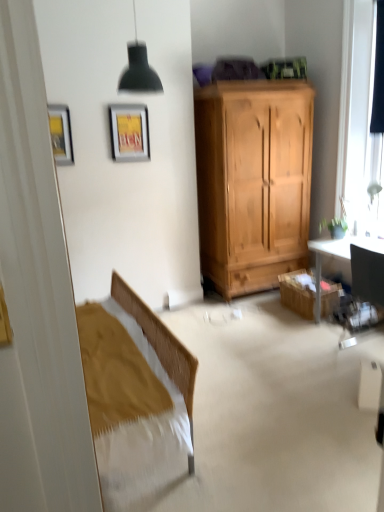
You are a GUI agent. You are given a task and a screenshot of the screen. Output one action in this format:
    pyautogui.click(x=<x>, y=<y>)
    Task: Click on the black fabric curtain at right
    The height and width of the screenshot is (512, 384).
    Given the screenshot: What is the action you would take?
    pyautogui.click(x=378, y=75)

Identify the location of transparent glass window at upper right. [x=357, y=109].

Measure the distance between transparent glass window at upper right and camera.

3.41 meters.

Identify the location of metallic silver picture frame at upper center, which appears as the second picture frame when viewed from the left. (129, 132).

This screenshot has height=512, width=384. Describe the element at coordinates (298, 292) in the screenshot. I see `wooden cabinet at lower right` at that location.

Identify the location of black fabric curtain at right. Image resolution: width=384 pixels, height=512 pixels. (378, 75).

Could you tell me if matte black lampshade at upper center is turned towards black fabric curtain at right?

No, matte black lampshade at upper center is not facing towards black fabric curtain at right.

From the image's perspective, which is below, matte black lampshade at upper center or black fabric curtain at right?

matte black lampshade at upper center, from the image's perspective.

Based on the photo, does matte black lampshade at upper center come behind black fabric curtain at right?

No, matte black lampshade at upper center is in front of black fabric curtain at right.

Does matte black lampshade at upper center have a lesser height compared to black fabric curtain at right?

Yes.

Who is shorter, wooden cabinet at lower right or metallic silver picture frame at upper center, arranged as the first picture frame when viewed from the back?

With less height is wooden cabinet at lower right.

Considering the sizes of wooden cabinet at lower right and metallic silver picture frame at upper center, which is the second picture frame from front to back, in the image, is wooden cabinet at lower right wider or thinner than metallic silver picture frame at upper center, which is the second picture frame from front to back,?

Considering their sizes, wooden cabinet at lower right looks broader than metallic silver picture frame at upper center, which is the second picture frame from front to back.

Which point is more forward, (310,308) or (124,142)?

Positioned in front is point (124,142).

Which is correct: wooden cabinet at lower right is inside metallic silver picture frame at upper center, arranged as the first picture frame when viewed from the back, or outside of it?

wooden cabinet at lower right is located beyond the bounds of metallic silver picture frame at upper center, arranged as the first picture frame when viewed from the back.

Which object is wider, metallic silver picture frame at upper center, which is the second picture frame from front to back, or black fabric curtain at right?

metallic silver picture frame at upper center, which is the second picture frame from front to back, is wider.

Considering the relative sizes of metallic silver picture frame at upper center, placed as the first picture frame when sorted from right to left, and black fabric curtain at right in the image provided, is metallic silver picture frame at upper center, placed as the first picture frame when sorted from right to left, shorter than black fabric curtain at right?

Yes.

From a real-world perspective, which is physically above, metallic gold picture frame at upper left, the second picture frame from the right, or matte black lampshade at upper center?

From a 3D spatial view, matte black lampshade at upper center is above.

Can you confirm if metallic gold picture frame at upper left, positioned as the 2th picture frame in back-to-front order, is positioned to the left of matte black lampshade at upper center?

Correct, you'll find metallic gold picture frame at upper left, positioned as the 2th picture frame in back-to-front order, to the left of matte black lampshade at upper center.

Is metallic gold picture frame at upper left, acting as the 1th picture frame starting from the left, far away from matte black lampshade at upper center?

They are positioned close to each other.

Looking at this image, from the image's perspective, is metallic gold picture frame at upper left, positioned as the 2th picture frame in back-to-front order, on top of matte black lampshade at upper center?

No.

Does metallic gold picture frame at upper left, positioned as the 2th picture frame in back-to-front order, appear on the right side of metallic silver picture frame at upper center, which is the second picture frame from front to back?

No.

Where is `picture frame on the right of metallic gold picture frame at upper left, marked as the 1th picture frame in a front-to-back arrangement`? picture frame on the right of metallic gold picture frame at upper left, marked as the 1th picture frame in a front-to-back arrangement is located at coordinates (129, 132).

Between point (63, 160) and point (127, 111), which one is positioned behind?

Point (127, 111)

Can you confirm if metallic gold picture frame at upper left, acting as the 1th picture frame starting from the left, is shorter than metallic silver picture frame at upper center, arranged as the first picture frame when viewed from the back?

Indeed, metallic gold picture frame at upper left, acting as the 1th picture frame starting from the left, has a lesser height compared to metallic silver picture frame at upper center, arranged as the first picture frame when viewed from the back.

Which of these two, metallic silver picture frame at upper center, arranged as the first picture frame when viewed from the back, or wooden cabinet at lower right, stands taller?

Standing taller between the two is metallic silver picture frame at upper center, arranged as the first picture frame when viewed from the back.

From the image's perspective, is metallic silver picture frame at upper center, which is the second picture frame from front to back, below wooden cabinet at lower right?

No, from the image's perspective, metallic silver picture frame at upper center, which is the second picture frame from front to back, is not beneath wooden cabinet at lower right.

From a real-world perspective, is metallic silver picture frame at upper center, which is the second picture frame from front to back, positioned above or below wooden cabinet at lower right?

metallic silver picture frame at upper center, which is the second picture frame from front to back, is situated higher than wooden cabinet at lower right in the real world.

Does point (119, 117) lie in front of point (312, 310)?

That is True.

From the image's perspective, which one is positioned higher, transparent glass window at upper right or metallic silver picture frame at upper center, arranged as the first picture frame when viewed from the back?

transparent glass window at upper right, from the image's perspective.

Is the position of transparent glass window at upper right less distant than that of metallic silver picture frame at upper center, arranged as the first picture frame when viewed from the back?

That is True.

At what (x,y) coordinates should I click in order to perform the action: click on window above the metallic silver picture frame at upper center, arranged as the first picture frame when viewed from the back (from a real-world perspective). Please return your answer as a coordinate pair (x, y). The height and width of the screenshot is (512, 384). Looking at the image, I should click on (357, 109).

The width and height of the screenshot is (384, 512). Find the location of `lamp in front of the black fabric curtain at right`. lamp in front of the black fabric curtain at right is located at coordinates (139, 69).

There is a wooden cabinet at lower right. At what (x,y) coordinates should I click in order to perform the action: click on the 2nd picture frame above it (from the image's perspective). Please return your answer as a coordinate pair (x, y). This screenshot has height=512, width=384. Looking at the image, I should click on [x=129, y=132].

When comparing their distances from black fabric curtain at right, does metallic silver picture frame at upper center, placed as the first picture frame when sorted from right to left, or metallic gold picture frame at upper left, acting as the 1th picture frame starting from the left, seem closer?

metallic silver picture frame at upper center, placed as the first picture frame when sorted from right to left, lies closer to black fabric curtain at right than the other object.

From the image, which object appears to be nearer to metallic silver picture frame at upper center, placed as the first picture frame when sorted from right to left, black fabric curtain at right or matte black lampshade at upper center?

matte black lampshade at upper center.

Based on their spatial positions, is metallic gold picture frame at upper left, acting as the 1th picture frame starting from the left, or black fabric curtain at right further from metallic silver picture frame at upper center, which is the second picture frame from front to back?

black fabric curtain at right.

Considering their positions, is metallic gold picture frame at upper left, the second picture frame from the right, positioned further to metallic silver picture frame at upper center, which appears as the second picture frame when viewed from the left, than transparent glass window at upper right?

transparent glass window at upper right is positioned further to the anchor metallic silver picture frame at upper center, which appears as the second picture frame when viewed from the left.

Based on their spatial positions, is wooden cabinet at lower right or transparent glass window at upper right further from black fabric curtain at right?

Among the two, wooden cabinet at lower right is located further to black fabric curtain at right.

Looking at the image, which one is located further to wooden cabinet at lower right, transparent glass window at upper right or black fabric curtain at right?

Based on the image, black fabric curtain at right appears to be further to wooden cabinet at lower right.

Estimate the real-world distances between objects in this image. Which object is further from black fabric curtain at right, transparent glass window at upper right or metallic silver picture frame at upper center, placed as the first picture frame when sorted from right to left?

Among the two, metallic silver picture frame at upper center, placed as the first picture frame when sorted from right to left, is located further to black fabric curtain at right.

Estimate the real-world distances between objects in this image. Which object is closer to matte black lampshade at upper center, transparent glass window at upper right or metallic silver picture frame at upper center, which appears as the second picture frame when viewed from the left?

metallic silver picture frame at upper center, which appears as the second picture frame when viewed from the left, lies closer to matte black lampshade at upper center than the other object.

Locate an element on the screen. This screenshot has height=512, width=384. cabinetry located between metallic gold picture frame at upper left, the second picture frame from the right, and transparent glass window at upper right in the left-right direction is located at coordinates (298, 292).

Identify the location of lamp situated between metallic gold picture frame at upper left, marked as the 1th picture frame in a front-to-back arrangement, and wooden cabinet at lower right from left to right. This screenshot has height=512, width=384. (139, 69).

Find the location of a particular element. This screenshot has height=512, width=384. lamp between metallic silver picture frame at upper center, which appears as the second picture frame when viewed from the left, and transparent glass window at upper right from left to right is located at coordinates (139, 69).

At what (x,y) coordinates should I click in order to perform the action: click on window between matte black lampshade at upper center and black fabric curtain at right from left to right. Please return your answer as a coordinate pair (x, y). The height and width of the screenshot is (512, 384). Looking at the image, I should click on (357, 109).